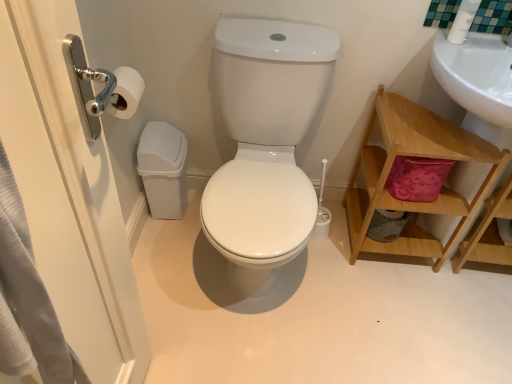
Question: From the image's perspective, relative to white plastic toilet brush at upper right, is brushed metal door handle at left above or below?

Choices:
 (A) above
 (B) below

Answer: (B)

Question: From a real-world perspective, is brushed metal door handle at left above or below white plastic toilet brush at upper right?

Choices:
 (A) below
 (B) above

Answer: (A)

Question: Estimate the real-world distances between objects in this image. Which object is farther from the white glossy toilet at center?

Choices:
 (A) brushed metal door handle at left
 (B) wooden shelf at right
 (C) white plastic toilet brush at upper right

Answer: (C)

Question: Estimate the real-world distances between objects in this image. Which object is farther from the wooden shelf at right?

Choices:
 (A) brushed metal door handle at left
 (B) white plastic toilet brush at upper right
 (C) white glossy toilet at center

Answer: (A)